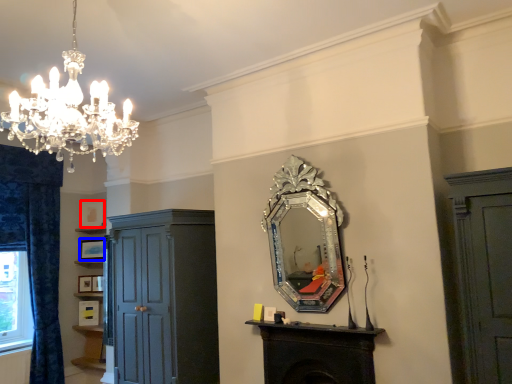
Question: Which of the following is the closest to the observer, picture frame (highlighted by a red box) or picture frame (highlighted by a blue box)?

Choices:
 (A) picture frame
 (B) picture frame

Answer: (B)